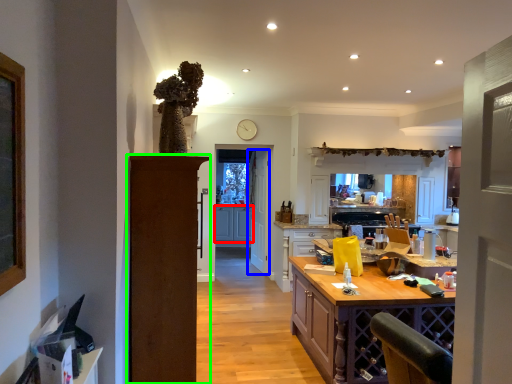
Question: Considering the real-world distances, which object is closest to cabinetry (highlighted by a red box)? door (highlighted by a blue box) or door (highlighted by a green box).

Choices:
 (A) door
 (B) door

Answer: (A)